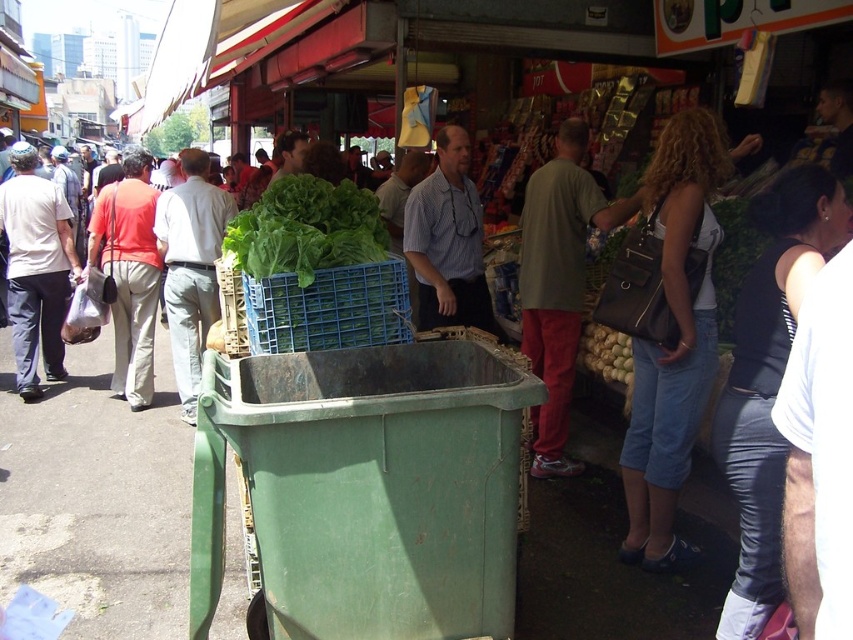
Can you confirm if green leafy lettuce at center is positioned to the left of light gray cotton pants at center-left?

In fact, green leafy lettuce at center is to the right of light gray cotton pants at center-left.

From the picture: Does green leafy lettuce at center appear under light gray cotton pants at center-left?

Actually, green leafy lettuce at center is above light gray cotton pants at center-left.

Which is in front, point (322, 266) or point (204, 164)?

Point (322, 266) is in front.

In order to click on green leafy lettuce at center in this screenshot , I will do `click(306, 228)`.

Can you confirm if green plastic cart at center is positioned to the right of white cotton shirt at left?

Indeed, green plastic cart at center is positioned on the right side of white cotton shirt at left.

Does green plastic cart at center have a larger size compared to white cotton shirt at left?

No.

Who is more distant from viewer, (x=277, y=483) or (x=16, y=156)?

The point (x=16, y=156) is behind.

The height and width of the screenshot is (640, 853). In order to click on green plastic cart at center in this screenshot , I will do `click(367, 486)`.

In the scene shown: Does matte green shirt at center have a greater height compared to striped cotton shirt at center?

Yes.

Is matte green shirt at center in front of striped cotton shirt at center?

Yes, matte green shirt at center is in front of striped cotton shirt at center.

Where is `matte green shirt at center`? The height and width of the screenshot is (640, 853). matte green shirt at center is located at coordinates (558, 282).